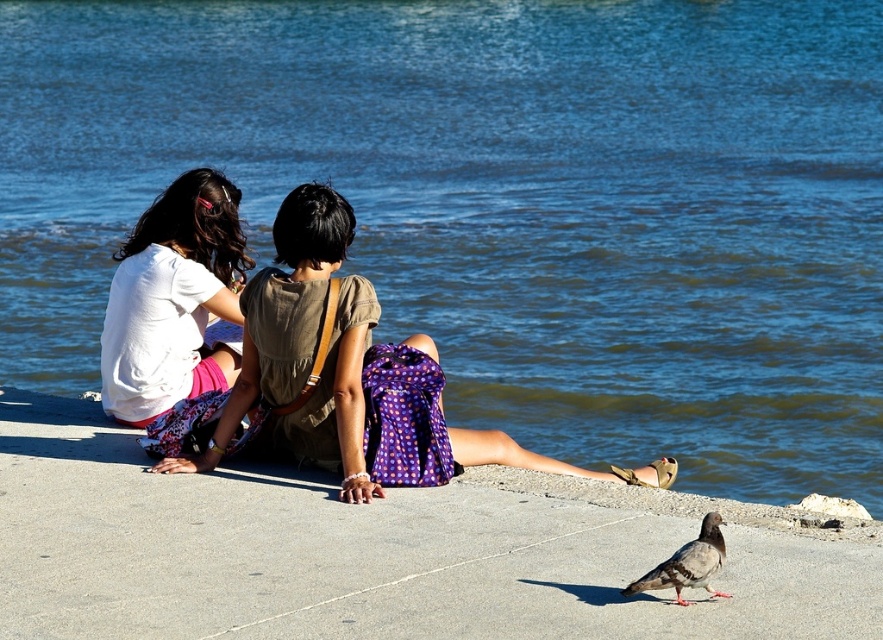
You are a photographer trying to capture a photo of the gray concrete at center and the gray matte pigeon at lower right. To ensure both subjects are in frame, which direction should you move your camera to align them properly?

The gray concrete at center is positioned on the left side of the gray matte pigeon at lower right, so you should move your camera slightly to the left to include both subjects in the frame.

You are a maintenance worker needing to clean the gray concrete at center and the gray matte pigeon at lower right. If your cleaning tool has a 4 feet reach, can you clean both areas without moving closer? Please explain.

The gray concrete at center is 4.16 feet away from the gray matte pigeon at lower right. Since the tool only reaches 4 feet, you cannot clean both areas without moving closer because the distance between them exceeds the tool reach.

You are standing behind the two people in the image and want to place a small picnic basket between the gray concrete at center and the white matte shirt at upper left. According to the scene description, which object should the picnic basket be closer to?

The gray concrete at center is in front of the white matte shirt at upper left, so the picnic basket should be placed closer to the gray concrete at center to be between them.